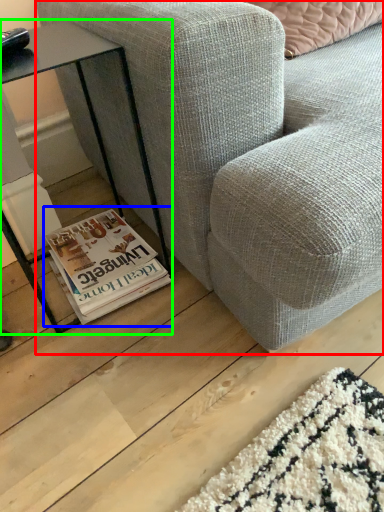
Question: Based on their relative distances, which object is farther from studio couch (highlighted by a red box)? Choose from paperback book (highlighted by a blue box) and table (highlighted by a green box).

Choices:
 (A) paperback book
 (B) table

Answer: (A)